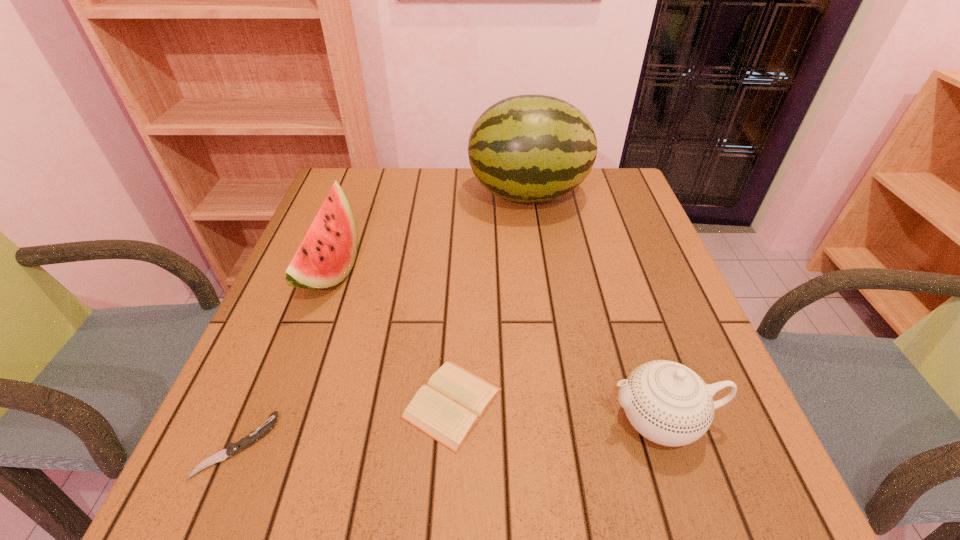
This screenshot has width=960, height=540. I want to click on free space between the right watermelon and the third tallest object, so click(x=594, y=306).

The width and height of the screenshot is (960, 540). I want to click on empty space that is in between the shorter watermelon and the diary, so click(392, 337).

This screenshot has width=960, height=540. I want to click on the third closest object to the pocketknife, so click(668, 403).

Select which object appears as the fourth closest to the fourth nearest object. Please provide its 2D coordinates. Your answer should be formatted as a tuple, i.e. [(x, y)], where the tuple contains the x and y coordinates of a point satisfying the conditions above.

[(668, 403)]

In order to click on vacant position in the image that satisfies the following two spatial constraints: 1. on the outer rind of the diary; 2. on the left side of the left watermelon in this screenshot , I will do `click(281, 403)`.

Find the location of a particular element. The width and height of the screenshot is (960, 540). vacant space that satisfies the following two spatial constraints: 1. on the outer rind of the shorter watermelon; 2. on the right side of the fourth tallest object is located at coordinates (281, 403).

This screenshot has width=960, height=540. Identify the location of vacant region that satisfies the following two spatial constraints: 1. on the spout of the chinaware; 2. on the front side of the pocketknife. (670, 446).

This screenshot has height=540, width=960. I want to click on vacant point that satisfies the following two spatial constraints: 1. at the stem end of the farther watermelon; 2. on the front side of the pocketknife, so click(564, 446).

In order to click on free spot that satisfies the following two spatial constraints: 1. on the back side of the second shortest object; 2. on the right side of the shortest object in this screenshot , I will do `click(254, 403)`.